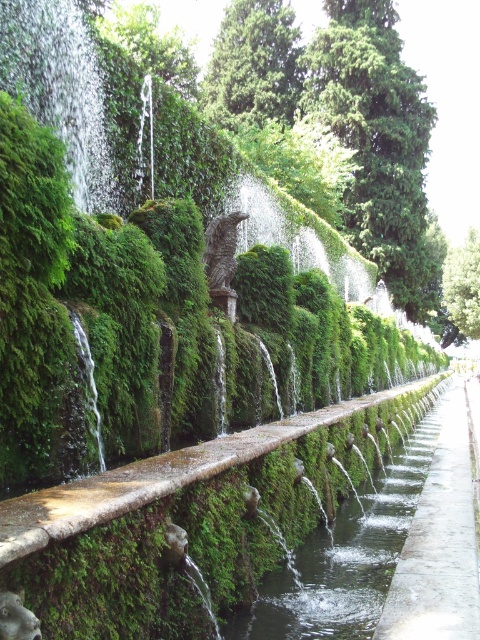
You are a gardener who wants to plant a new flower bed. You have two options for locations in the garden scene shown. The first option is near the concrete at center, and the second option is near the green mossy wall at upper left. Considering the positions of these objects, which location would be higher in elevation?

The green mossy wall at upper left is higher in elevation than the concrete at center because the concrete at center is below it.